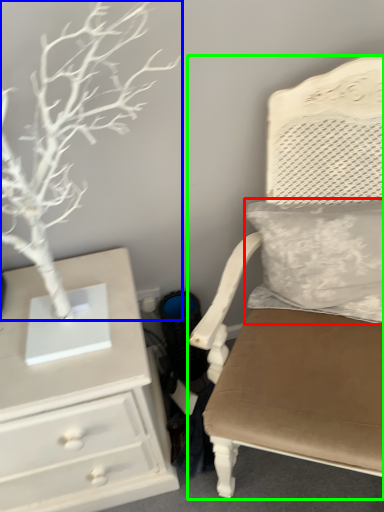
Question: Based on their relative distances, which object is nearer to pillow (highlighted by a red box)? Choose from tree (highlighted by a blue box) and chair (highlighted by a green box).

Choices:
 (A) tree
 (B) chair

Answer: (B)